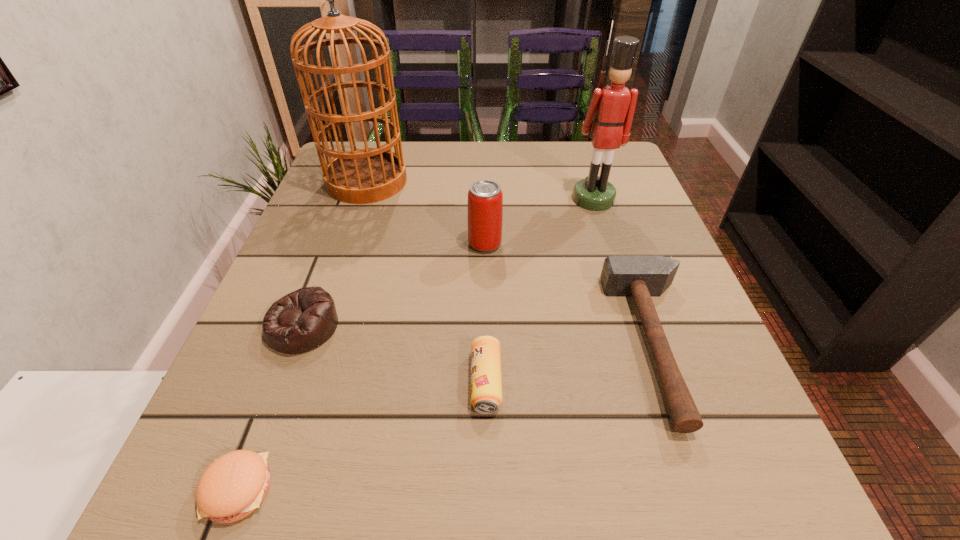
Identify the location of free space that is in between the hammer and the beanbag. The image size is (960, 540). (481, 335).

Locate an element on the screen. The width and height of the screenshot is (960, 540). free spot between the third farthest object and the nutcracker is located at coordinates (539, 221).

Where is `the sixth closest object to the hammer`? The width and height of the screenshot is (960, 540). the sixth closest object to the hammer is located at coordinates (234, 485).

Locate which object is the fifth closest to the beanbag. Please provide its 2D coordinates. Your answer should be formatted as a tuple, i.e. [(x, y)], where the tuple contains the x and y coordinates of a point satisfying the conditions above.

[(641, 277)]

The width and height of the screenshot is (960, 540). In order to click on vacant region that satisfies the following two spatial constraints: 1. on the back side of the tallest object; 2. on the left side of the patty in this screenshot , I will do `click(355, 181)`.